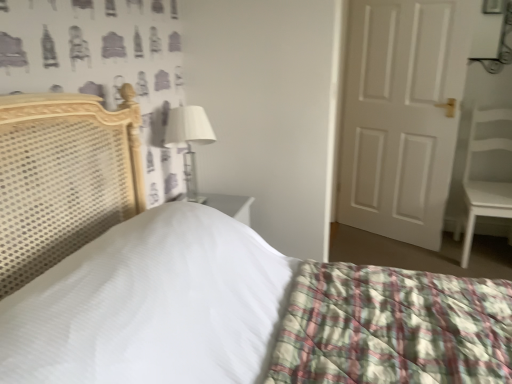
I want to click on white fabric-covered lampshade at upper center, so click(189, 140).

In order to click on white matte chair at right in this screenshot , I will do `click(485, 181)`.

Where is `white fabric-covered lampshade at upper center`? Image resolution: width=512 pixels, height=384 pixels. white fabric-covered lampshade at upper center is located at coordinates (189, 140).

Considering the relative positions of white matte door at right and white fabric-covered lampshade at upper center in the image provided, is white matte door at right behind white fabric-covered lampshade at upper center?

Yes, white matte door at right is behind white fabric-covered lampshade at upper center.

From the image's perspective, which one is positioned higher, white matte door at right or white fabric-covered lampshade at upper center?

white matte door at right is shown above in the image.

Can you confirm if white matte door at right is wider than white fabric-covered lampshade at upper center?

No, white matte door at right is not wider than white fabric-covered lampshade at upper center.

Can you confirm if white matte door at right is positioned to the left of white matte chair at right?

Yes, white matte door at right is to the left of white matte chair at right.

Considering the sizes of objects white matte door at right and white matte chair at right in the image provided, who is thinner, white matte door at right or white matte chair at right?

Thinner between the two is white matte door at right.

Based on their sizes in the image, would you say white matte door at right is bigger or smaller than white matte chair at right?

Considering their sizes, white matte door at right takes up less space than white matte chair at right.

From the image's perspective, relative to white matte chair at right, is white matte door at right above or below?

From the image's perspective, white matte door at right appears above white matte chair at right.

Is white matte chair at right bigger than white fabric-covered lampshade at upper center?

Indeed, white matte chair at right has a larger size compared to white fabric-covered lampshade at upper center.

In the image, there is a white fabric-covered lampshade at upper center. Where is `armchair below it (from a real-world perspective)`? The image size is (512, 384). armchair below it (from a real-world perspective) is located at coordinates (485, 181).

Who is shorter, white matte chair at right or white fabric-covered lampshade at upper center?

Standing shorter between the two is white fabric-covered lampshade at upper center.

Considering the positions of objects white matte chair at right and white fabric-covered lampshade at upper center in the image provided, who is more to the left, white matte chair at right or white fabric-covered lampshade at upper center?

Positioned to the left is white fabric-covered lampshade at upper center.

Does point (194, 117) come behind point (467, 205)?

No, (194, 117) is in front of (467, 205).

From the image's perspective, is white fabric-covered lampshade at upper center above white matte chair at right?

Correct, white fabric-covered lampshade at upper center appears higher than white matte chair at right in the image.

Which of these two, white fabric-covered lampshade at upper center or white matte chair at right, stands shorter?

With less height is white fabric-covered lampshade at upper center.

Choose the correct answer: Is white fabric-covered lampshade at upper center inside white matte chair at right or outside it?

white fabric-covered lampshade at upper center is outside white matte chair at right.

Find the location of a particular element. table lamp above the white matte door at right (from a real-world perspective) is located at coordinates (189, 140).

Does white fabric-covered lampshade at upper center turn towards white matte door at right?

No, white fabric-covered lampshade at upper center does not turn towards white matte door at right.

Considering the relative positions of white fabric-covered lampshade at upper center and white matte door at right in the image provided, is white fabric-covered lampshade at upper center to the left of white matte door at right from the viewer's perspective?

Yes, white fabric-covered lampshade at upper center is to the left of white matte door at right.

Is white fabric-covered lampshade at upper center not within white matte door at right?

Absolutely, white fabric-covered lampshade at upper center is external to white matte door at right.

Which object is wider, white matte chair at right or white matte door at right?

Wider between the two is white matte chair at right.

Can you confirm if white matte chair at right is positioned to the right of white matte door at right?

Correct, you'll find white matte chair at right to the right of white matte door at right.

Is the position of white matte chair at right more distant than that of white matte door at right?

No, white matte chair at right is closer to the viewer.

Considering the relative sizes of white matte chair at right and white matte door at right in the image provided, is white matte chair at right bigger than white matte door at right?

Yes, white matte chair at right is bigger than white matte door at right.

You are a GUI agent. You are given a task and a screenshot of the screen. Output one action in this format:
    pyautogui.click(x=<x>, y=<y>)
    Task: Click on the table lamp located below the white matte door at right (from the image's perspective)
    This screenshot has height=384, width=512.
    Given the screenshot: What is the action you would take?
    pyautogui.click(x=189, y=140)

Where is `door above the white matte chair at right (from a real-world perspective)`? Image resolution: width=512 pixels, height=384 pixels. door above the white matte chair at right (from a real-world perspective) is located at coordinates (401, 115).

Looking at the image, which one is located further to white matte door at right, white matte chair at right or white fabric-covered lampshade at upper center?

Based on the image, white fabric-covered lampshade at upper center appears to be further to white matte door at right.

Estimate the real-world distances between objects in this image. Which object is further from white matte chair at right, white matte door at right or white fabric-covered lampshade at upper center?

Among the two, white fabric-covered lampshade at upper center is located further to white matte chair at right.

Considering their positions, is white fabric-covered lampshade at upper center positioned further to white matte door at right than white matte chair at right?

white fabric-covered lampshade at upper center is further to white matte door at right.

Estimate the real-world distances between objects in this image. Which object is further from white fabric-covered lampshade at upper center, white matte door at right or white matte chair at right?

white matte chair at right is positioned further to the anchor white fabric-covered lampshade at upper center.

From the image, which object appears to be farther from white matte chair at right, white fabric-covered lampshade at upper center or white matte door at right?

white fabric-covered lampshade at upper center lies further to white matte chair at right than the other object.

Considering their positions, is white matte chair at right positioned further to white fabric-covered lampshade at upper center than white matte door at right?

white matte chair at right is further to white fabric-covered lampshade at upper center.

Identify the location of door between white fabric-covered lampshade at upper center and white matte chair at right. Image resolution: width=512 pixels, height=384 pixels. (401, 115).